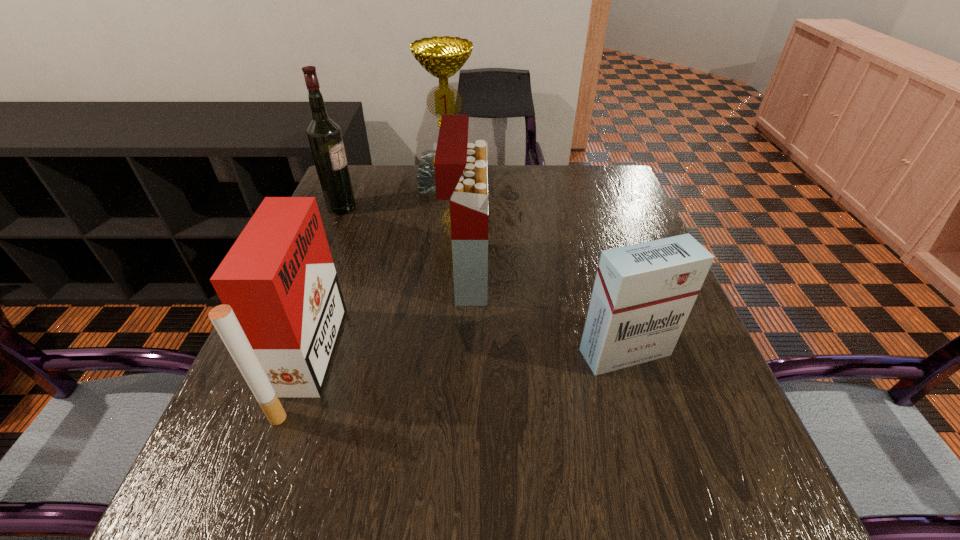
The image size is (960, 540). Identify the location of free space located on the back of the rightmost cigarette case. (601, 273).

Identify the location of award at the far edge. The height and width of the screenshot is (540, 960). (442, 57).

Where is `wine bottle present at the far edge`? This screenshot has height=540, width=960. wine bottle present at the far edge is located at coordinates (324, 135).

Where is `wine bottle positioned at the left edge`? wine bottle positioned at the left edge is located at coordinates (324, 135).

Locate an element on the screen. cigarette case positioned at the left edge is located at coordinates (282, 311).

Where is `object that is at the right edge`? This screenshot has height=540, width=960. object that is at the right edge is located at coordinates (643, 293).

You are a GUI agent. You are given a task and a screenshot of the screen. Output one action in this format:
    pyautogui.click(x=<x>, y=<y>)
    Task: Click on the object positioned at the far left corner
    This screenshot has height=540, width=960.
    Given the screenshot: What is the action you would take?
    324,135

Where is `vacant region at the near edge of the desktop`? Image resolution: width=960 pixels, height=540 pixels. vacant region at the near edge of the desktop is located at coordinates (532, 513).

In the image, there is a desktop. Identify the location of vacant space at the left edge. This screenshot has height=540, width=960. (286, 461).

Identify the location of vacant space at the right edge of the desktop. The width and height of the screenshot is (960, 540). (631, 384).